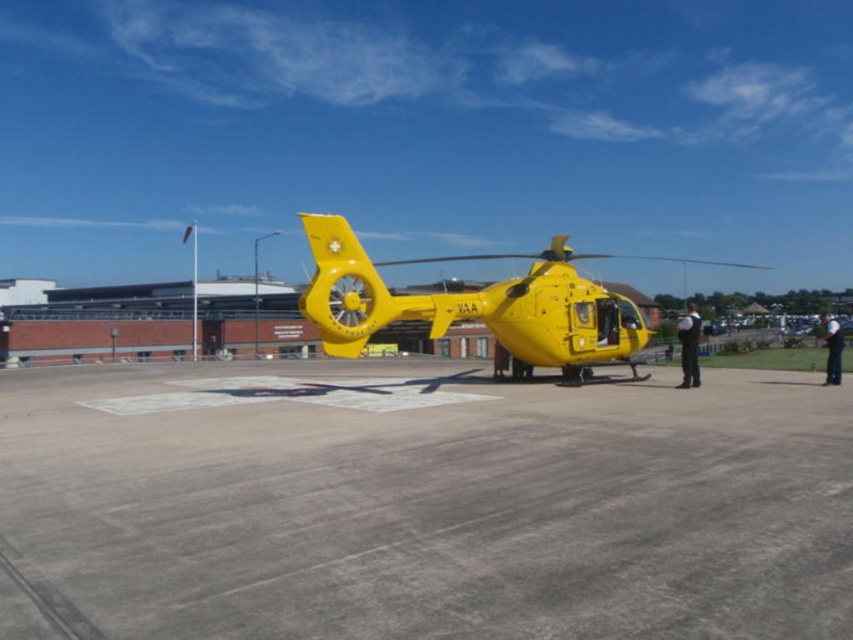
You are a pilot standing near the yellow matte helicopter at center and need to reach the black fabric person at right for an emergency medical transfer. Can you walk directly to them without going around the helicopter?

The yellow matte helicopter at center is closer to the viewer than the black fabric person at right, so you would need to walk around the helicopter to reach them.

You are a pilot preparing to take off in the yellow matte helicopter at center. You need to know if there is enough space on the gray concrete tarmac at center to perform a safe takeoff roll. The required runway length for takeoff is 30 feet. Can you confirm if the tarmac has sufficient space?

The distance between the gray concrete tarmac at center and the yellow matte helicopter at center is 35.71 feet, which exceeds the required 30 feet. Therefore, there is sufficient space for a safe takeoff roll.

You are a pilot preparing to land a helicopter. You see the gray concrete tarmac at center and the yellow matte helicopter at center in the image. Which area is large enough to safely land your helicopter?

The yellow matte helicopter at center is larger than the gray concrete tarmac at center, so the gray concrete tarmac at center may not be large enough to safely land your helicopter. Choose a different landing area.